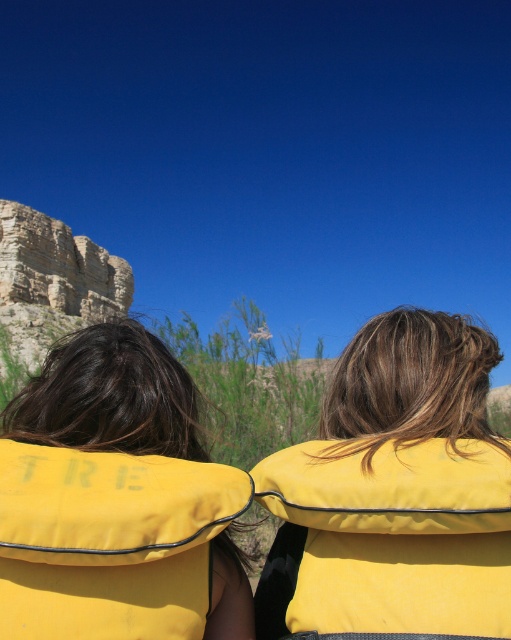
Question: Which object is positioned closest to the yellow fabric life vest at center?

Choices:
 (A) yellow fabric life jacket at upper center
 (B) yellow fabric life jacket at center

Answer: (B)

Question: Which point is closer to the camera taking this photo?

Choices:
 (A) (57, 529)
 (B) (403, 554)
 (C) (347, 476)

Answer: (A)

Question: Is yellow fabric life vest at center below yellow fabric life jacket at upper center?

Choices:
 (A) yes
 (B) no

Answer: (B)

Question: Among these points, which one is nearest to the camera?

Choices:
 (A) (333, 467)
 (B) (104, 490)

Answer: (B)

Question: Is yellow fabric life vest at center closer to camera compared to yellow fabric life jacket at upper center?

Choices:
 (A) yes
 (B) no

Answer: (B)

Question: Considering the relative positions of yellow fabric life jacket at center and yellow fabric life jacket at upper center in the image provided, where is yellow fabric life jacket at center located with respect to yellow fabric life jacket at upper center?

Choices:
 (A) left
 (B) right

Answer: (B)